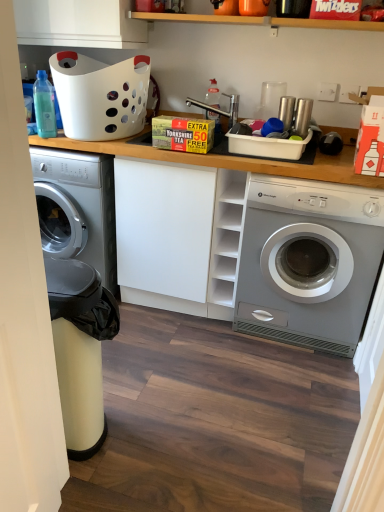
This screenshot has width=384, height=512. What do you see at coordinates (220, 109) in the screenshot?
I see `metallic faucet at center` at bounding box center [220, 109].

What are the coordinates of `satin silver washing machine at right` in the screenshot? It's located at point(308,262).

Could you tell me if white plastic basket at upper left is facing translucent plastic bottle at upper left, which is the second bottle in right-to-left order?

Yes, white plastic basket at upper left is facing translucent plastic bottle at upper left, which is the second bottle in right-to-left order.

From a real-world perspective, is white plastic basket at upper left above or below translucent plastic bottle at upper left, which is counted as the 2th bottle, starting from the back?

white plastic basket at upper left is situated higher than translucent plastic bottle at upper left, which is counted as the 2th bottle, starting from the back, in the real world.

Is white plastic basket at upper left in contact with translucent plastic bottle at upper left, positioned as the first bottle in left-to-right order?

They are not placed beside each other.

You are a GUI agent. You are given a task and a screenshot of the screen. Output one action in this format:
    pyautogui.click(x=<x>, y=<y>)
    Task: Click on the bottle on the left of the white plastic basket at upper left
    
    Given the screenshot: What is the action you would take?
    pyautogui.click(x=44, y=106)

Considering the sizes of translucent plastic bottle at upper left, which is counted as the 2th bottle, starting from the back, and white plastic basket at upper left in the image, is translucent plastic bottle at upper left, which is counted as the 2th bottle, starting from the back, bigger or smaller than white plastic basket at upper left?

Considering their sizes, translucent plastic bottle at upper left, which is counted as the 2th bottle, starting from the back, takes up less space than white plastic basket at upper left.

Can you confirm if translucent plastic bottle at upper left, marked as the 1th bottle in a front-to-back arrangement, is positioned to the right of white plastic basket at upper left?

No.

From the image's perspective, is translucent plastic bottle at upper left, which is the second bottle in right-to-left order, located above white plastic basket at upper left?

No.

Which of these two, translucent plastic bottle at upper left, which is counted as the 2th bottle, starting from the back, or white plastic basket at upper left, is wider?

white plastic basket at upper left is wider.

Considering the sizes of white plastic basket at upper left and metallic faucet at center in the image, is white plastic basket at upper left bigger or smaller than metallic faucet at center?

Considering their sizes, white plastic basket at upper left takes up more space than metallic faucet at center.

Considering the relative sizes of white plastic basket at upper left and metallic faucet at center in the image provided, is white plastic basket at upper left wider than metallic faucet at center?

Indeed, white plastic basket at upper left has a greater width compared to metallic faucet at center.

Considering the positions of point (118, 87) and point (215, 106), is point (118, 87) closer or farther from the camera than point (215, 106)?

Point (118, 87) appears to be closer to the viewer than point (215, 106).

Are white plastic basket at upper left and metallic faucet at center making contact?

No, white plastic basket at upper left is not in contact with metallic faucet at center.

Which of these two, metallic faucet at center or white matte cabinet at center, is thinner?

metallic faucet at center is thinner.

How distant is metallic faucet at center from white matte cabinet at center?

A distance of 75.20 centimeters exists between metallic faucet at center and white matte cabinet at center.

This screenshot has width=384, height=512. What are the coordinates of `sink that appears above the white matte cabinet at center (from a real-world perspective)` in the screenshot? It's located at (220, 109).

Would you consider metallic faucet at center to be distant from white matte cabinet at center?

No, there isn't a large distance between metallic faucet at center and white matte cabinet at center.

Does white matte cabinet at center contain translucent plastic bottle at center, acting as the second bottle starting from the front?

No, translucent plastic bottle at center, acting as the second bottle starting from the front, is not surrounded by white matte cabinet at center.

Considering the positions of points (130, 247) and (210, 96), is point (130, 247) closer to camera compared to point (210, 96)?

Yes, it is in front of point (210, 96).

Is white matte cabinet at center turned away from translucent plastic bottle at center, acting as the second bottle starting from the front?

white matte cabinet at center is not turned away from translucent plastic bottle at center, acting as the second bottle starting from the front.

Considering the positions of objects white matte cabinet at center and translucent plastic bottle at center, acting as the 2th bottle starting from the left, in the image provided, who is more to the right, white matte cabinet at center or translucent plastic bottle at center, acting as the 2th bottle starting from the left,?

From the viewer's perspective, translucent plastic bottle at center, acting as the 2th bottle starting from the left, appears more on the right side.

Is translucent plastic bottle at center, acting as the 2th bottle starting from the left, positioned far away from white matte cabinet at center?

No, translucent plastic bottle at center, acting as the 2th bottle starting from the left, is not far from white matte cabinet at center.

Based on the photo, which is more to the right, translucent plastic bottle at center, the 1th bottle from the back, or white matte cabinet at center?

Positioned to the right is translucent plastic bottle at center, the 1th bottle from the back.

Between translucent plastic bottle at center, acting as the second bottle starting from the front, and white matte cabinet at center, which one is positioned behind?

Positioned behind is translucent plastic bottle at center, acting as the second bottle starting from the front.

Between translucent plastic bottle at center, which is the 1th bottle from right to left, and white matte cabinet at center, which one has smaller width?

Thinner between the two is translucent plastic bottle at center, which is the 1th bottle from right to left.

Between satin silver washing machine at right and white matte cabinet at center, which one has smaller size?

Smaller between the two is white matte cabinet at center.

Does point (352, 241) come closer to viewer compared to point (207, 262)?

Yes, it is in front of point (207, 262).

Considering the relative positions of satin silver washing machine at right and white matte cabinet at center in the image provided, is satin silver washing machine at right in front of white matte cabinet at center?

That is True.

What's the angular difference between satin silver washing machine at right and white matte cabinet at center's facing directions?

There is a 0.462-degree angle between the facing directions of satin silver washing machine at right and white matte cabinet at center.

Locate an element on the screen. This screenshot has width=384, height=512. basket above the translucent plastic bottle at upper left, which is the second bottle in right-to-left order (from the image's perspective) is located at coordinates (100, 95).

This screenshot has height=512, width=384. Find the location of `basket above the translucent plastic bottle at upper left, positioned as the first bottle in left-to-right order (from a real-world perspective)`. basket above the translucent plastic bottle at upper left, positioned as the first bottle in left-to-right order (from a real-world perspective) is located at coordinates (100, 95).

Considering their positions, is metallic faucet at center positioned further to white matte cabinet at center than translucent plastic bottle at upper left, which is the second bottle in right-to-left order?

metallic faucet at center is positioned further to the anchor white matte cabinet at center.

Considering their positions, is translucent plastic bottle at upper left, which is the second bottle in right-to-left order, positioned closer to translucent plastic bottle at center, the 1th bottle from the back, than white plastic basket at upper left?

white plastic basket at upper left is closer to translucent plastic bottle at center, the 1th bottle from the back.

Estimate the real-world distances between objects in this image. Which object is further from translucent plastic bottle at center, acting as the second bottle starting from the front, white matte cabinet at center or satin silver washing machine at right?

satin silver washing machine at right.

Looking at the image, which one is located further to metallic faucet at center, white matte cabinet at center or white plastic basket at upper left?

Based on the image, white matte cabinet at center appears to be further to metallic faucet at center.

Looking at the image, which one is located closer to translucent plastic bottle at upper left, marked as the 1th bottle in a front-to-back arrangement, white plastic basket at upper left or satin silver washing machine at right?

Based on the image, white plastic basket at upper left appears to be nearer to translucent plastic bottle at upper left, marked as the 1th bottle in a front-to-back arrangement.

Considering their positions, is white matte cabinet at center positioned closer to white plastic basket at upper left than translucent plastic bottle at upper left, which is counted as the 2th bottle, starting from the back?

translucent plastic bottle at upper left, which is counted as the 2th bottle, starting from the back.

From the image, which object appears to be farther from metallic faucet at center, satin silver washing machine at right or white plastic basket at upper left?

satin silver washing machine at right lies further to metallic faucet at center than the other object.

When comparing their distances from white matte cabinet at center, does satin silver washing machine at right or white plastic basket at upper left seem closer?

white plastic basket at upper left.

At what (x,y) coordinates should I click in order to perform the action: click on bottle between translucent plastic bottle at upper left, marked as the 1th bottle in a front-to-back arrangement, and satin silver washing machine at right. Please return your answer as a coordinate pair (x, y). Image resolution: width=384 pixels, height=512 pixels. Looking at the image, I should click on click(x=213, y=94).

Find the location of a particular element. This screenshot has width=384, height=512. bottle between white plastic basket at upper left and white matte cabinet at center in the up-down direction is located at coordinates (44, 106).

Where is `sink between translucent plastic bottle at center, the 1th bottle from the back, and white matte cabinet at center in the up-down direction`? The width and height of the screenshot is (384, 512). sink between translucent plastic bottle at center, the 1th bottle from the back, and white matte cabinet at center in the up-down direction is located at coordinates (220, 109).

In order to click on basket between translucent plastic bottle at upper left, which is counted as the 2th bottle, starting from the back, and metallic faucet at center, in the horizontal direction in this screenshot , I will do (x=100, y=95).